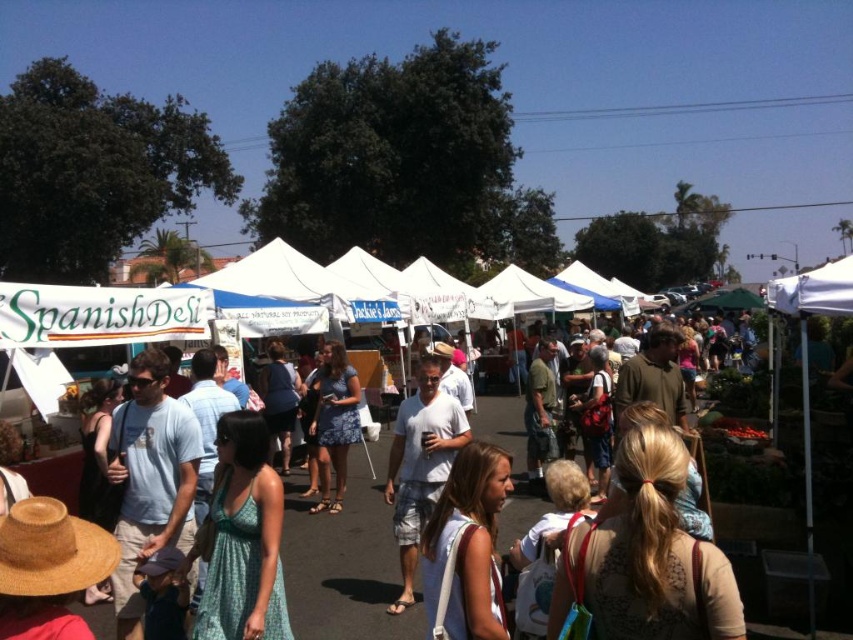
Question: Among these objects, which one is farthest from the camera?

Choices:
 (A) white fabric spanish deli at center
 (B) matte blue dress at center
 (C) white cotton t-shirt at center

Answer: (B)

Question: Based on their relative distances, which object is nearer to the white cotton t-shirt at center?

Choices:
 (A) white fabric spanish deli at center
 (B) matte blue dress at center

Answer: (A)

Question: Which is nearer to the white cotton t-shirt at center?

Choices:
 (A) matte blue dress at center
 (B) white fabric spanish deli at center

Answer: (B)

Question: Does white fabric spanish deli at center appear on the left side of white cotton t-shirt at center?

Choices:
 (A) yes
 (B) no

Answer: (A)

Question: Does white fabric spanish deli at center appear over matte blue dress at center?

Choices:
 (A) yes
 (B) no

Answer: (B)

Question: Does white cotton t-shirt at center appear on the left side of matte blue dress at center?

Choices:
 (A) no
 (B) yes

Answer: (A)